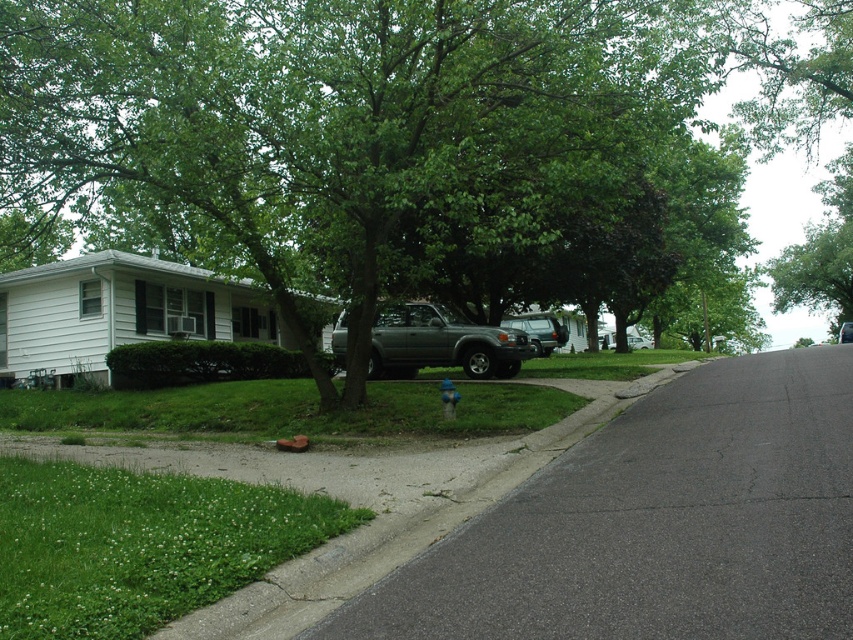
You are standing at the point closest to the white house with black shutters in the suburban scene. There are two points marked in the image, point A at coordinates point (84, 170) and point B at coordinates point (367, 378). Which point is closer to you?

Point A at coordinates point (84, 170) is closer to you than point B at coordinates point (367, 378).

You are standing at point A located at coordinates (373, 145) in the image. What object is directly in front of you?

The green leafy tree at center is located at point (373, 145), so the object directly in front of you is the green leafy tree at center.